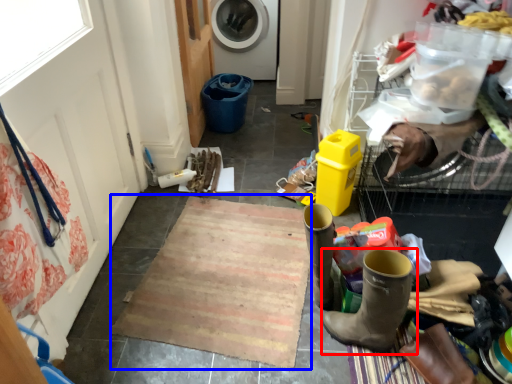
Question: Which object appears closest to the camera in this image, footwear (highlighted by a red box) or doormat (highlighted by a blue box)?

Choices:
 (A) footwear
 (B) doormat

Answer: (A)